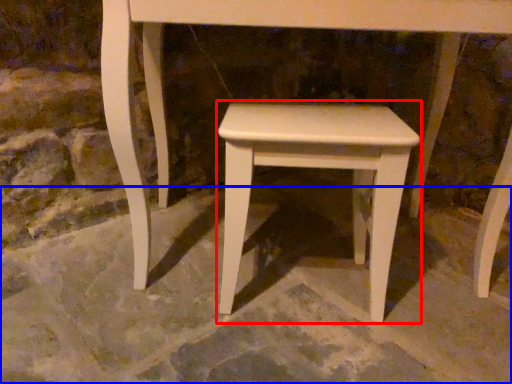
Question: Which point is closer to the camera, stool (highlighted by a red box) or concrete (highlighted by a blue box)?

Choices:
 (A) stool
 (B) concrete

Answer: (B)